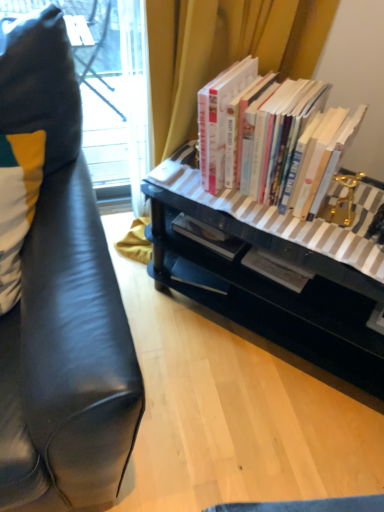
At what (x,y) coordinates should I click in order to perform the action: click on free spot in front of hardcover books at center. Please return your answer as a coordinate pair (x, y). The width and height of the screenshot is (384, 512). Looking at the image, I should click on (307, 238).